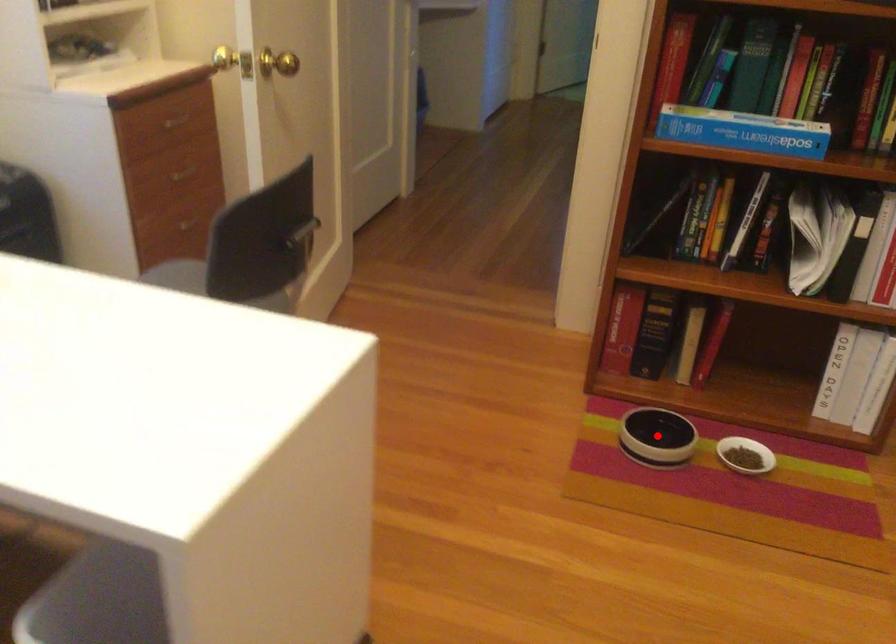
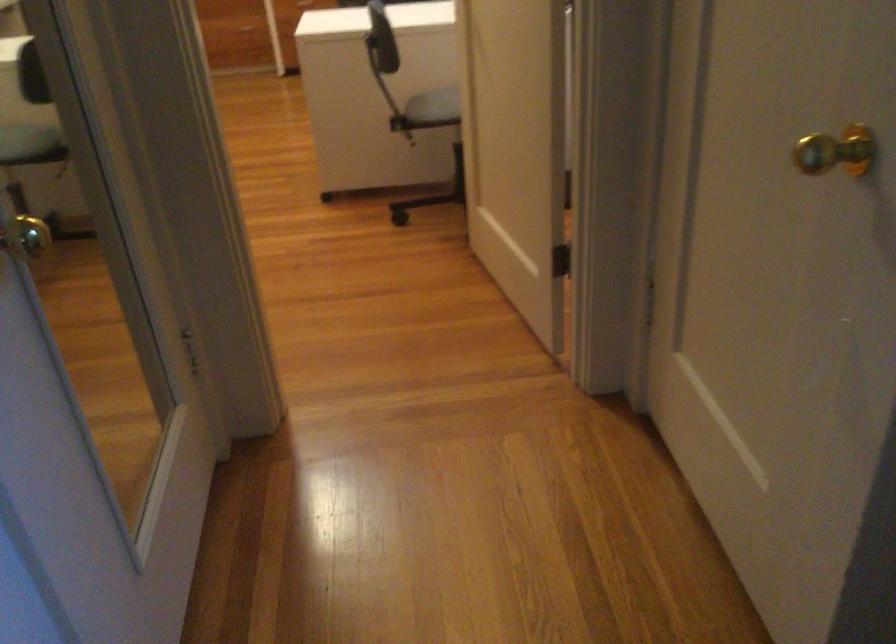
Question: I am providing you with two images of the same scene from different viewpoints. A red point is marked on the first image. At the location where the point appears in image 1, is it still visible in image 2?

Choices:
 (A) Yes
 (B) No

Answer: (B)